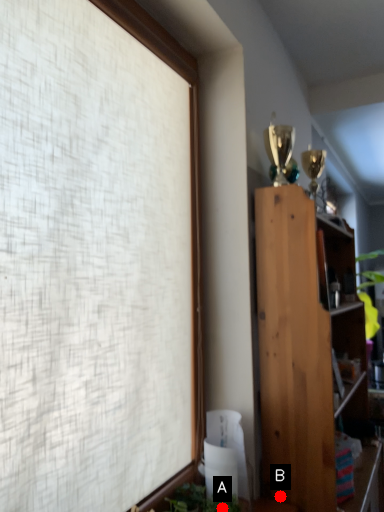
Question: Two points are circled on the image, labeled by A and B beside each circle. Which point is closer to the camera?

Choices:
 (A) A is closer
 (B) B is closer

Answer: (A)